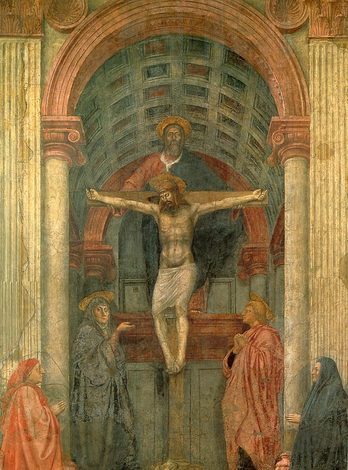
This screenshot has height=470, width=348. I want to click on ornate ceiling, so click(x=179, y=75).